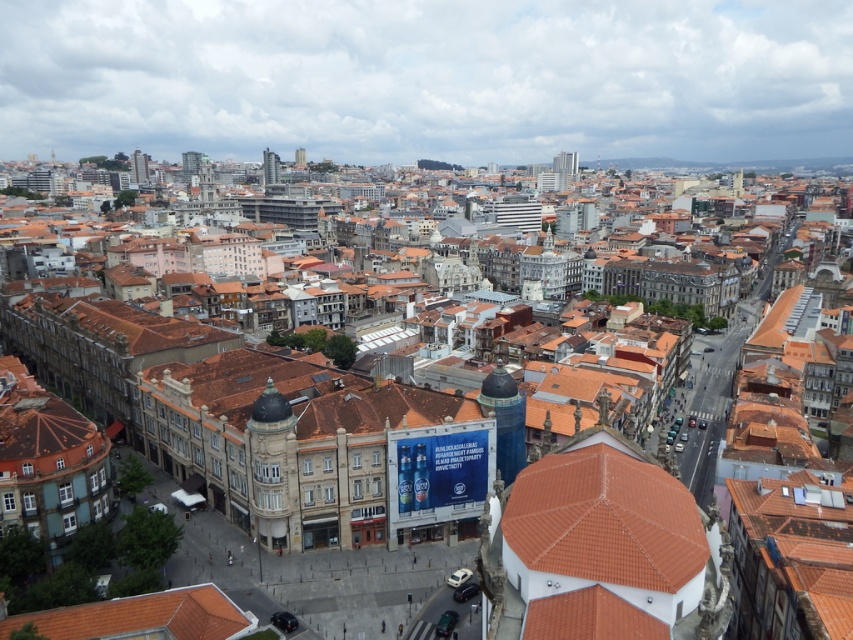
Which is more to the right, gold textured dome at center or metallic glass tower at upper center?

Positioned to the right is gold textured dome at center.

The width and height of the screenshot is (853, 640). What do you see at coordinates (273, 472) in the screenshot? I see `gold textured dome at center` at bounding box center [273, 472].

Locate an element on the screen. The image size is (853, 640). gold textured dome at center is located at coordinates (273, 472).

Which is more to the left, orange tile roof at lower left or blue glass tower at center?

orange tile roof at lower left

Measure the distance between orange tile roof at lower left and blue glass tower at center.

52.96 meters

Who is more distant from viewer, [80,609] or [521,424]?

The point [521,424] is more distant.

Identify the location of orange tile roof at lower left. This screenshot has height=640, width=853. (142, 618).

Does blue glass tower at center appear on the left side of metallic glass tower at upper left?

In fact, blue glass tower at center is to the right of metallic glass tower at upper left.

Who is shorter, blue glass tower at center or metallic glass tower at upper left?

blue glass tower at center

Is point (496, 372) less distant than point (183, 170)?

That is True.

Locate an element on the screen. blue glass tower at center is located at coordinates (505, 420).